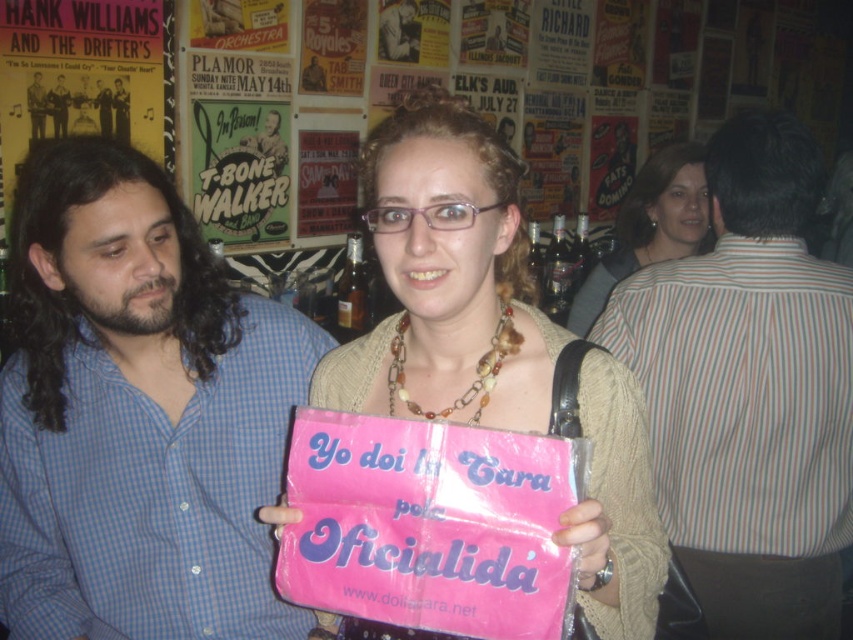
Question: Is matte beige sweater at center wider than matte blue shirt at left?

Choices:
 (A) yes
 (B) no

Answer: (A)

Question: Which of the following is the farthest from the observer?

Choices:
 (A) blue checkered shirt at center
 (B) pink paper sign at center
 (C) blue checkered shirt at left

Answer: (C)

Question: Does striped shirt at center appear over matte beige sweater at center?

Choices:
 (A) yes
 (B) no

Answer: (B)

Question: Which object is the closest to the blue checkered shirt at left?

Choices:
 (A) matte blue shirt at left
 (B) smooth black shirt at upper left
 (C) matte beige sweater at center

Answer: (A)

Question: In this image, where is striped shirt at center located relative to blue checkered shirt at left?

Choices:
 (A) left
 (B) right

Answer: (B)

Question: Which object appears farthest from the camera in this image?

Choices:
 (A) blue checkered shirt at center
 (B) striped shirt at center
 (C) matte blue shirt at left

Answer: (C)